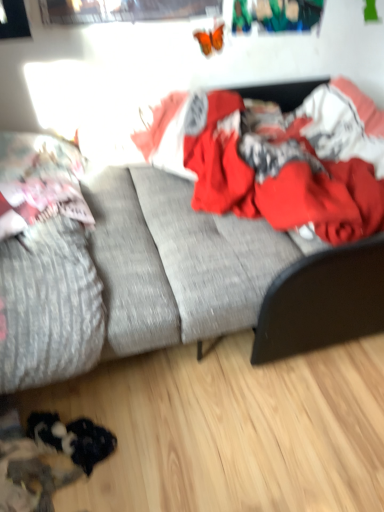
Question: Is fluffy pink pillow at left situated inside textured gray mattress at left or outside?

Choices:
 (A) outside
 (B) inside

Answer: (B)

Question: Based on their sizes in the image, would you say fluffy pink pillow at left is bigger or smaller than textured gray mattress at left?

Choices:
 (A) small
 (B) big

Answer: (A)

Question: Considering the real-world distances, which object is closest to the fluffy pink pillow at left?

Choices:
 (A) textured gray couch at center
 (B) red cotton blanket at center
 (C) textured gray mattress at left

Answer: (C)

Question: Considering the real-world distances, which object is closest to the fluffy pink pillow at left?

Choices:
 (A) textured gray mattress at left
 (B) red cotton blanket at center
 (C) textured gray couch at center

Answer: (A)